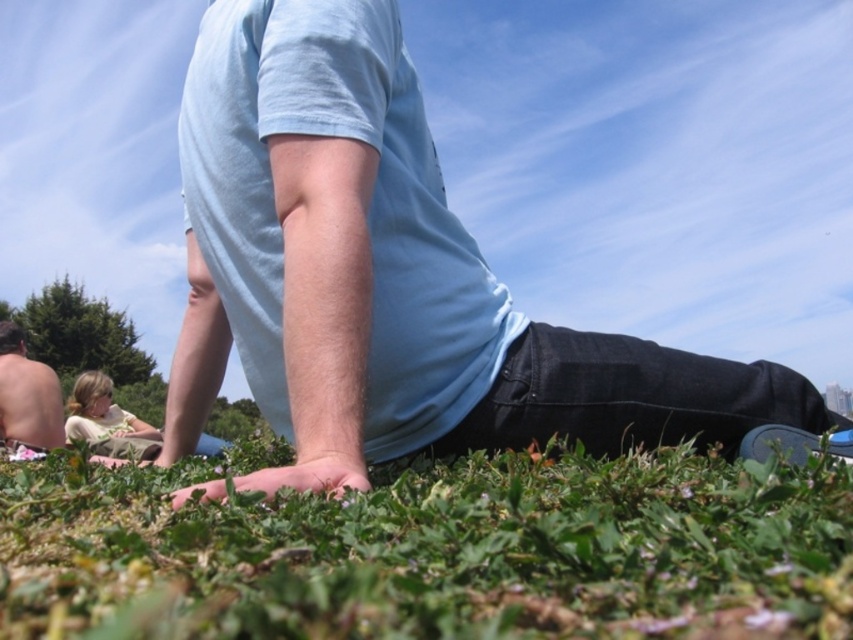
Question: Which of the following is the farthest from the observer?

Choices:
 (A) (68, 522)
 (B) (209, 211)

Answer: (B)

Question: From the image, what is the correct spatial relationship of light blue cotton shirt at center in relation to shiny silver torso at lower left?

Choices:
 (A) right
 (B) left

Answer: (A)

Question: Among these objects, which one is farthest from the camera?

Choices:
 (A) green grass at lower center
 (B) light blue cotton shirt at center
 (C) shiny silver torso at lower left

Answer: (C)

Question: Is green grass at lower center to the left of shiny silver torso at lower left from the viewer's perspective?

Choices:
 (A) no
 (B) yes

Answer: (A)

Question: Which object is the closest to the green grass at lower center?

Choices:
 (A) light blue cotton shirt at center
 (B) shiny silver torso at lower left

Answer: (A)

Question: Is green grass at lower center thinner than shiny silver torso at lower left?

Choices:
 (A) no
 (B) yes

Answer: (A)